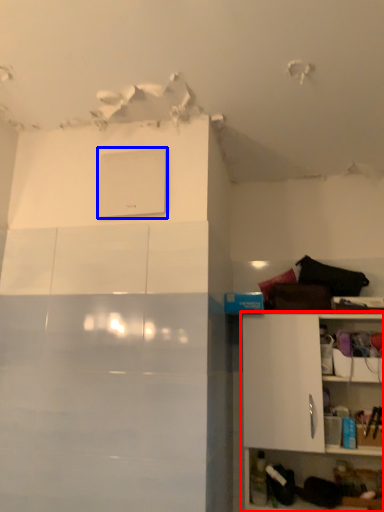
Question: Which point is closer to the camera, shelf (highlighted by a red box) or appliance (highlighted by a blue box)?

Choices:
 (A) shelf
 (B) appliance

Answer: (A)